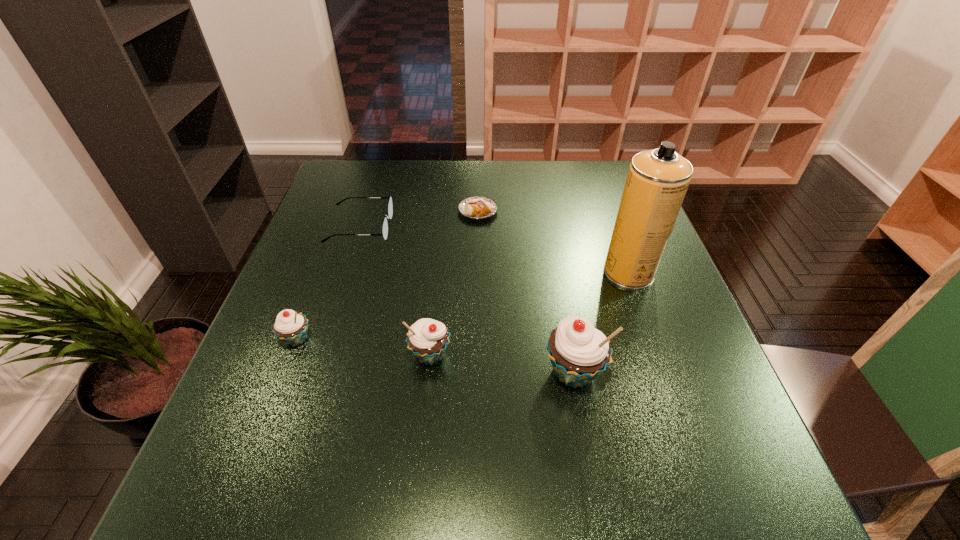
Where is `the third shortest object`? the third shortest object is located at coordinates (291, 327).

You are a GUI agent. You are given a task and a screenshot of the screen. Output one action in this format:
    pyautogui.click(x=<x>, y=<y>)
    Task: Click on the leftmost cupcake
    This screenshot has height=540, width=960.
    Given the screenshot: What is the action you would take?
    pyautogui.click(x=291, y=327)

Locate an element on the screen. the third tallest object is located at coordinates (427, 339).

Identify the location of the second cupcake from left to right. This screenshot has width=960, height=540. (427, 339).

Locate an element on the screen. The width and height of the screenshot is (960, 540). the fifth shortest object is located at coordinates (578, 352).

Image resolution: width=960 pixels, height=540 pixels. What are the coordinates of `the rightmost cupcake` in the screenshot? It's located at (578, 352).

You are a GUI agent. You are given a task and a screenshot of the screen. Output one action in this format:
    pyautogui.click(x=<x>, y=<y>)
    Task: Click on the pastry
    This screenshot has width=960, height=540.
    Given the screenshot: What is the action you would take?
    pyautogui.click(x=475, y=207)

You are a GUI agent. You are given a task and a screenshot of the screen. Output one action in this format:
    pyautogui.click(x=<x>, y=<y>)
    Task: Click on the second shortest object
    
    Given the screenshot: What is the action you would take?
    pyautogui.click(x=390, y=208)

At what (x,y) coordinates should I click in order to perform the action: click on the rightmost object. Please return your answer as a coordinate pair (x, y). The height and width of the screenshot is (540, 960). Looking at the image, I should click on (657, 181).

You are a GUI agent. You are given a task and a screenshot of the screen. Output one action in this format:
    pyautogui.click(x=<x>, y=<y>)
    Task: Click on the tallest object
    The height and width of the screenshot is (540, 960).
    Given the screenshot: What is the action you would take?
    pyautogui.click(x=657, y=181)